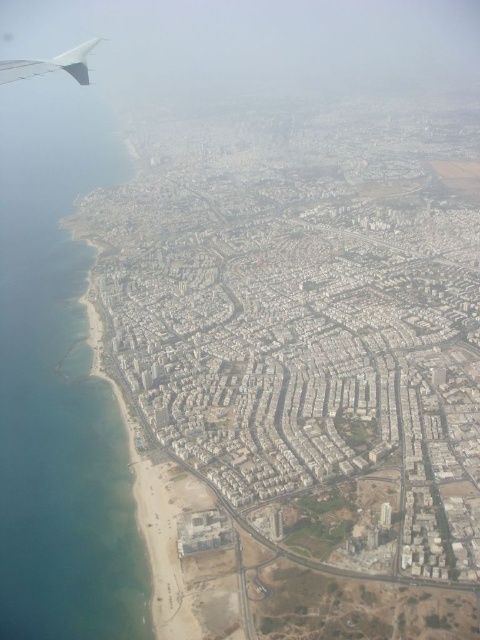
Question: Does blue water at left have a larger size compared to matte gray winglet at upper left?

Choices:
 (A) yes
 (B) no

Answer: (A)

Question: Which object is closer to the camera taking this photo?

Choices:
 (A) matte gray winglet at upper left
 (B) blue water at left

Answer: (B)

Question: Does blue water at left have a greater width compared to matte gray winglet at upper left?

Choices:
 (A) no
 (B) yes

Answer: (B)

Question: Does blue water at left lie in front of matte gray winglet at upper left?

Choices:
 (A) no
 (B) yes

Answer: (B)